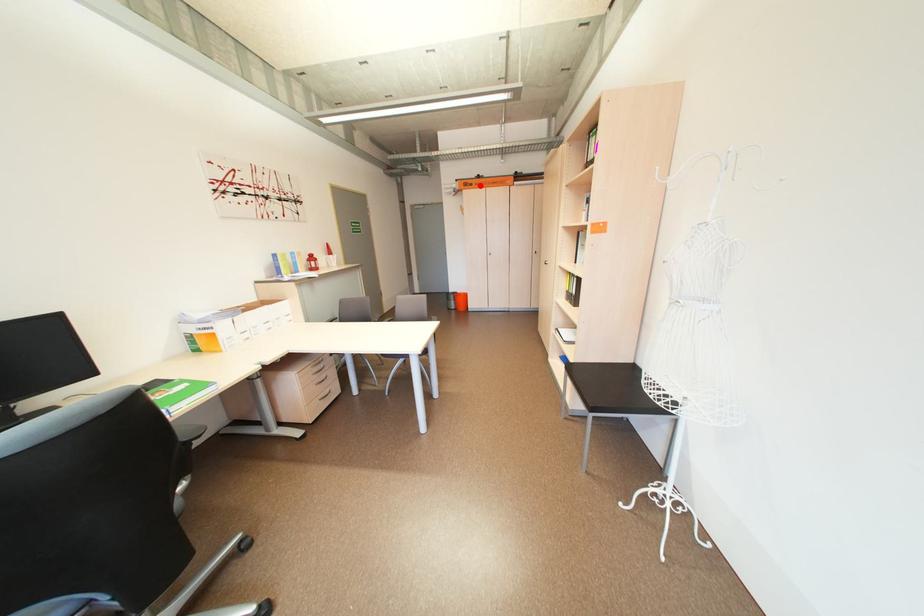
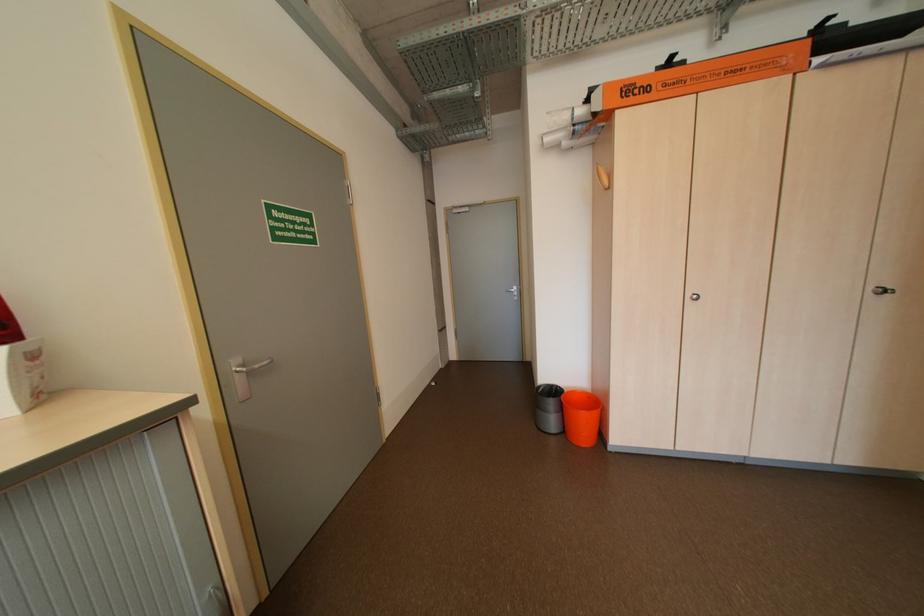
The point at the highlighted location is marked in the first image. Where is the corresponding point in the second image?

(655, 90)